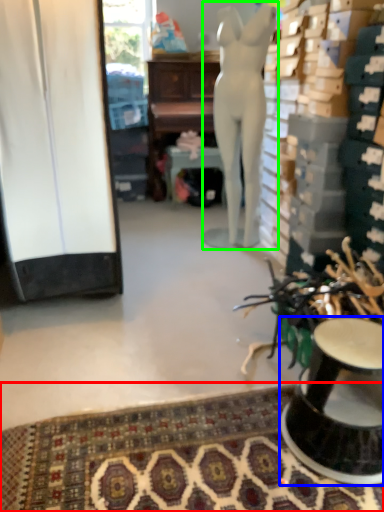
Question: Based on their relative distances, which object is nearer to mat (highlighted by a red box)? Choose from furniture (highlighted by a blue box) and person (highlighted by a green box).

Choices:
 (A) furniture
 (B) person

Answer: (A)